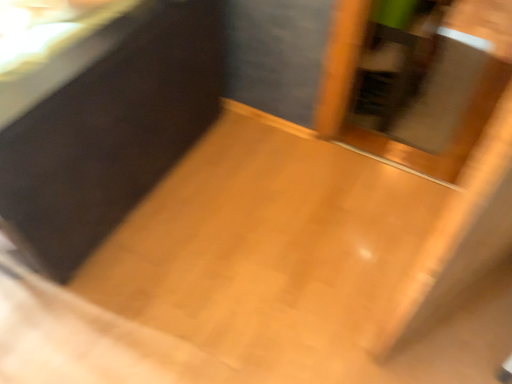
Describe the element at coordinates (426, 81) in the screenshot. The image size is (512, 384). I see `transparent glass screen door at center` at that location.

The width and height of the screenshot is (512, 384). Identify the location of transparent glass screen door at center. point(426,81).

What do you see at coordinates (104, 123) in the screenshot?
I see `matte black vanity at upper left` at bounding box center [104, 123].

Locate an element on the screen. matte black vanity at upper left is located at coordinates (104, 123).

The width and height of the screenshot is (512, 384). Identify the location of transparent glass screen door at center. (426, 81).

Which is more to the left, transparent glass screen door at center or matte black vanity at upper left?

matte black vanity at upper left.

Which object is further away from the camera, transparent glass screen door at center or matte black vanity at upper left?

transparent glass screen door at center is further away from the camera.

Between point (490, 110) and point (46, 246), which one is positioned behind?

The point (490, 110) is farther from the camera.

From the image's perspective, is transparent glass screen door at center on matte black vanity at upper left?

Yes, from the image's perspective, transparent glass screen door at center is on top of matte black vanity at upper left.

From a real-world perspective, which object stands above the other?

From a 3D spatial view, matte black vanity at upper left is above.

Is transparent glass screen door at center wider or thinner than matte black vanity at upper left?

In the image, transparent glass screen door at center appears to be wider than matte black vanity at upper left.

Is transparent glass screen door at center taller or shorter than matte black vanity at upper left?

In the image, transparent glass screen door at center appears to be shorter than matte black vanity at upper left.

Looking at the image, does transparent glass screen door at center seem bigger or smaller compared to matte black vanity at upper left?

transparent glass screen door at center is smaller than matte black vanity at upper left.

Is matte black vanity at upper left located within transparent glass screen door at center?

No, matte black vanity at upper left is not inside transparent glass screen door at center.

Are transparent glass screen door at center and matte black vanity at upper left far apart?

transparent glass screen door at center is near matte black vanity at upper left, not far away.

Is transparent glass screen door at center facing towards matte black vanity at upper left?

No, transparent glass screen door at center is not oriented towards matte black vanity at upper left.

Can you tell me how much transparent glass screen door at center and matte black vanity at upper left differ in facing direction?

The angular difference between transparent glass screen door at center and matte black vanity at upper left is 1.14 degrees.

Find the location of `vanity located above the transparent glass screen door at center (from a real-world perspective)`. vanity located above the transparent glass screen door at center (from a real-world perspective) is located at coordinates (104, 123).

From the picture: Is matte black vanity at upper left to the right of transparent glass screen door at center from the viewer's perspective?

No, matte black vanity at upper left is not to the right of transparent glass screen door at center.

Relative to transparent glass screen door at center, is matte black vanity at upper left in front or behind?

Clearly, matte black vanity at upper left is in front of transparent glass screen door at center.

Does point (83, 31) come in front of point (348, 124)?

Yes, point (83, 31) is in front of point (348, 124).

From the image's perspective, which one is positioned higher, matte black vanity at upper left or transparent glass screen door at center?

transparent glass screen door at center appears higher in the image.

Looking at this image, from a real-world perspective, between matte black vanity at upper left and transparent glass screen door at center, who is vertically lower?

transparent glass screen door at center, from a real-world perspective.

Is matte black vanity at upper left wider or thinner than transparent glass screen door at center?

matte black vanity at upper left is thinner than transparent glass screen door at center.

Considering the sizes of objects matte black vanity at upper left and transparent glass screen door at center in the image provided, who is taller, matte black vanity at upper left or transparent glass screen door at center?

Standing taller between the two is matte black vanity at upper left.

Who is bigger, matte black vanity at upper left or transparent glass screen door at center?

With larger size is matte black vanity at upper left.

Is matte black vanity at upper left positioned beyond the bounds of transparent glass screen door at center?

That's correct, matte black vanity at upper left is outside of transparent glass screen door at center.

Would you say matte black vanity at upper left is a long distance from transparent glass screen door at center?

matte black vanity at upper left is near transparent glass screen door at center, not far away.

Is matte black vanity at upper left facing away from transparent glass screen door at center?

No, matte black vanity at upper left is not facing away from transparent glass screen door at center.

In order to click on vanity in front of the transparent glass screen door at center in this screenshot , I will do `click(104, 123)`.

The width and height of the screenshot is (512, 384). In order to click on vanity that appears above the transparent glass screen door at center (from a real-world perspective) in this screenshot , I will do `click(104, 123)`.

The height and width of the screenshot is (384, 512). In order to click on screen door on the right of matte black vanity at upper left in this screenshot , I will do `click(426, 81)`.